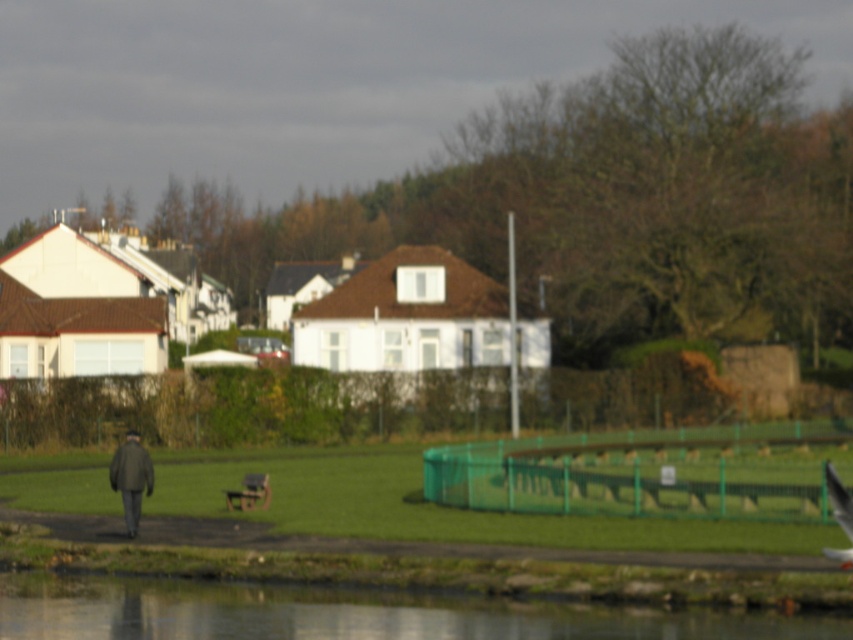
Question: Can you confirm if transparent water at lower center is positioned below white feathered bird at lower right?

Choices:
 (A) no
 (B) yes

Answer: (B)

Question: Which point appears closest to the camera in this image?

Choices:
 (A) (456, 598)
 (B) (241, 496)

Answer: (A)

Question: Observing the image, what is the correct spatial positioning of dark gray wool coat at lower left in reference to wooden park bench at center?

Choices:
 (A) above
 (B) below

Answer: (A)

Question: Which point is closer to the camera?

Choices:
 (A) (129, 440)
 (B) (843, 492)
 (C) (234, 618)
 (D) (254, 484)

Answer: (B)

Question: Based on their relative distances, which object is nearer to the wooden park bench at center?

Choices:
 (A) dark gray wool coat at lower left
 (B) transparent water at lower center

Answer: (A)

Question: Is transparent water at lower center to the right of white feathered bird at lower right from the viewer's perspective?

Choices:
 (A) no
 (B) yes

Answer: (A)